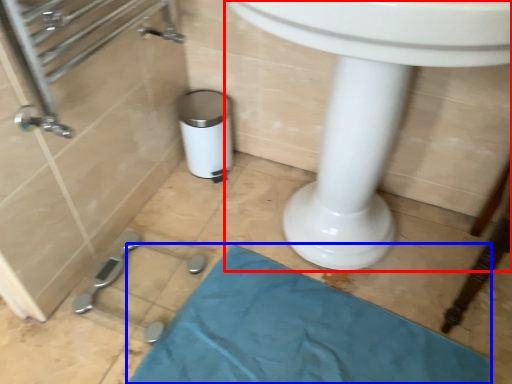
Question: Which point is closer to the camera, sink (highlighted by a red box) or bath mat (highlighted by a blue box)?

Choices:
 (A) sink
 (B) bath mat

Answer: (A)